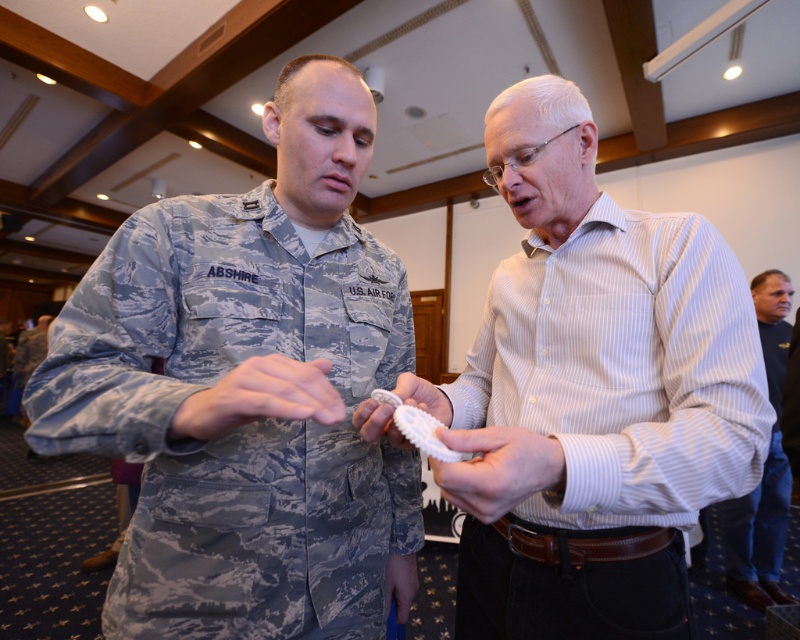
Question: Can you confirm if white striped shirt at center is bigger than matte blue fabric at lower center?

Choices:
 (A) no
 (B) yes

Answer: (B)

Question: Estimate the real-world distances between objects in this image. Which object is closer to the camouflage uniform at center?

Choices:
 (A) camouflage fabric hand at center
 (B) white striped shirt at center

Answer: (A)

Question: Is camouflage fabric hand at center below matte blue fabric at lower center?

Choices:
 (A) yes
 (B) no

Answer: (B)

Question: Which of the following is the closest to the observer?

Choices:
 (A) camouflage uniform at center
 (B) blue jeans at lower right
 (C) white striped shirt at center

Answer: (A)

Question: Does camouflage uniform at center appear over camouflage fabric hand at center?

Choices:
 (A) no
 (B) yes

Answer: (B)

Question: Which object appears closest to the camera in this image?

Choices:
 (A) camouflage fabric hand at center
 (B) white striped shirt at center
 (C) white matte gear at center

Answer: (A)